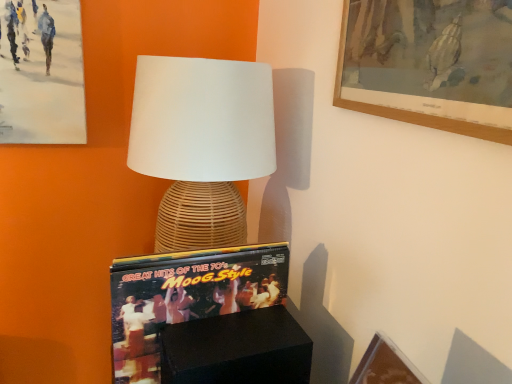
In order to click on black matte box at lower center in this screenshot , I will do `click(237, 349)`.

Identify the location of matte vinyl record at center. The height and width of the screenshot is (384, 512). (186, 297).

Image resolution: width=512 pixels, height=384 pixels. Describe the element at coordinates (186, 297) in the screenshot. I see `matte vinyl record at center` at that location.

Where is `black matte box at lower center`? black matte box at lower center is located at coordinates point(237,349).

From a real-world perspective, is black matte box at lower center above or below woven rattan lamp at center?

From a real-world perspective, black matte box at lower center is physically below woven rattan lamp at center.

Which is correct: black matte box at lower center is inside woven rattan lamp at center, or outside of it?

black matte box at lower center is not enclosed by woven rattan lamp at center.

Which object is further away from the camera taking this photo, black matte box at lower center or woven rattan lamp at center?

Positioned behind is woven rattan lamp at center.

From a real-world perspective, is woven rattan lamp at center under black matte box at lower center?

Actually, woven rattan lamp at center is physically above black matte box at lower center in the real world.

Is woven rattan lamp at center facing away from black matte box at lower center?

No, black matte box at lower center is not at the back of woven rattan lamp at center.

Is woven rattan lamp at center not near black matte box at lower center?

No, woven rattan lamp at center is in close proximity to black matte box at lower center.

From the image's perspective, does woven rattan lamp at center appear lower than black matte box at lower center?

No, from the image's perspective, woven rattan lamp at center is not beneath black matte box at lower center.

How many degrees apart are the facing directions of matte vinyl record at center and black matte box at lower center?

There is a 2.52-degree angle between the facing directions of matte vinyl record at center and black matte box at lower center.

Between matte vinyl record at center and black matte box at lower center, which one is positioned behind?

matte vinyl record at center.

Considering the sizes of objects matte vinyl record at center and black matte box at lower center in the image provided, who is bigger, matte vinyl record at center or black matte box at lower center?

Bigger between the two is matte vinyl record at center.

Is matte vinyl record at center turned away from black matte box at lower center?

No.

Is there a large distance between matte vinyl record at center and woven rattan lamp at center?

That's not correct — matte vinyl record at center is a little close to woven rattan lamp at center.

Is matte vinyl record at center positioned with its back to woven rattan lamp at center?

No, matte vinyl record at center is not facing the opposite direction of woven rattan lamp at center.

From the image's perspective, which is below, matte vinyl record at center or woven rattan lamp at center?

matte vinyl record at center appears lower in the image.

Are black matte box at lower center and matte vinyl record at center located far from each other?

black matte box at lower center is near matte vinyl record at center, not far away.

From the picture: Does black matte box at lower center contain matte vinyl record at center?

No, black matte box at lower center does not contain matte vinyl record at center.

Which is in front, point (252, 361) or point (140, 271)?

The point (140, 271) is more forward.

Is woven rattan lamp at center bigger or smaller than matte vinyl record at center?

In the image, woven rattan lamp at center appears to be larger than matte vinyl record at center.

From the image's perspective, would you say woven rattan lamp at center is shown under matte vinyl record at center?

No, from the image's perspective, woven rattan lamp at center is not beneath matte vinyl record at center.

In the image, is woven rattan lamp at center positioned in front of or behind matte vinyl record at center?

Clearly, woven rattan lamp at center is behind matte vinyl record at center.

This screenshot has width=512, height=384. I want to click on lamp behind the matte vinyl record at center, so click(201, 144).

Where is `lamp behind the black matte box at lower center`? The height and width of the screenshot is (384, 512). lamp behind the black matte box at lower center is located at coordinates (201, 144).

Identify the location of lamp that is above the black matte box at lower center (from a real-world perspective). (201, 144).

Which object lies nearer to the anchor point matte vinyl record at center, black matte box at lower center or woven rattan lamp at center?

black matte box at lower center.

Estimate the real-world distances between objects in this image. Which object is closer to matte vinyl record at center, woven rattan lamp at center or black matte box at lower center?

Among the two, black matte box at lower center is located nearer to matte vinyl record at center.

When comparing their distances from woven rattan lamp at center, does black matte box at lower center or matte vinyl record at center seem further?

black matte box at lower center lies further to woven rattan lamp at center than the other object.

Which object lies nearer to the anchor point black matte box at lower center, matte vinyl record at center or woven rattan lamp at center?

matte vinyl record at center lies closer to black matte box at lower center than the other object.

Considering their positions, is woven rattan lamp at center positioned closer to black matte box at lower center than matte vinyl record at center?

Based on the image, matte vinyl record at center appears to be nearer to black matte box at lower center.

Estimate the real-world distances between objects in this image. Which object is closer to woven rattan lamp at center, matte vinyl record at center or black matte box at lower center?

matte vinyl record at center is closer to woven rattan lamp at center.

You are a GUI agent. You are given a task and a screenshot of the screen. Output one action in this format:
    pyautogui.click(x=<x>, y=<y>)
    Task: Click on the magazine between woven rattan lamp at center and black matte box at lower center in the up-down direction
    The height and width of the screenshot is (384, 512).
    Given the screenshot: What is the action you would take?
    pyautogui.click(x=186, y=297)